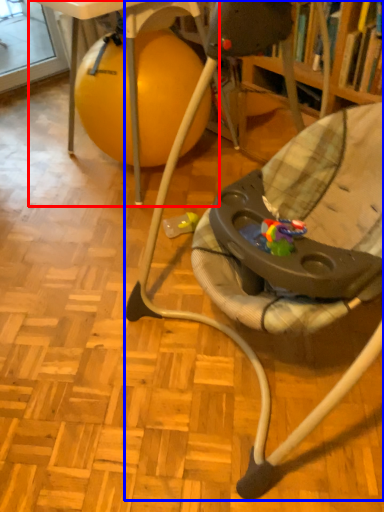
Question: Which object is further to the camera taking this photo, table (highlighted by a red box) or chair (highlighted by a blue box)?

Choices:
 (A) table
 (B) chair

Answer: (A)